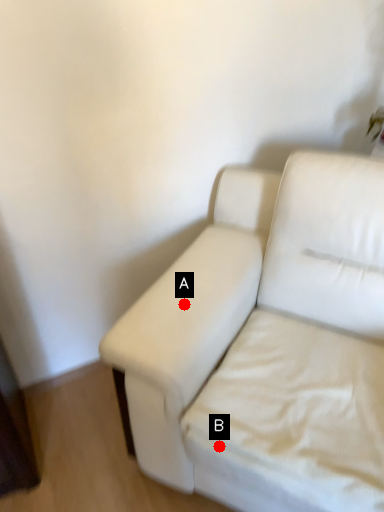
Question: Two points are circled on the image, labeled by A and B beside each circle. Which point is farther from the camera taking this photo?

Choices:
 (A) A is further
 (B) B is further

Answer: (A)